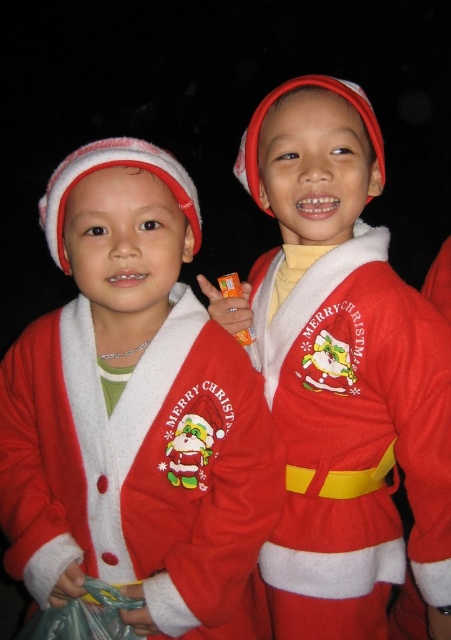
Question: Which of the following is the closest to the observer?

Choices:
 (A) fuzzy red santa coat at center
 (B) fuzzy red santa costume at center

Answer: (A)

Question: Is fuzzy red santa coat at center behind fuzzy red santa costume at center?

Choices:
 (A) no
 (B) yes

Answer: (A)

Question: Can you confirm if fuzzy red santa coat at center is positioned above fuzzy red santa costume at center?

Choices:
 (A) no
 (B) yes

Answer: (A)

Question: Does fuzzy red santa coat at center appear under fuzzy red santa costume at center?

Choices:
 (A) yes
 (B) no

Answer: (A)

Question: Which of the following is the farthest from the observer?

Choices:
 (A) fuzzy red santa costume at center
 (B) fuzzy red santa coat at center

Answer: (A)